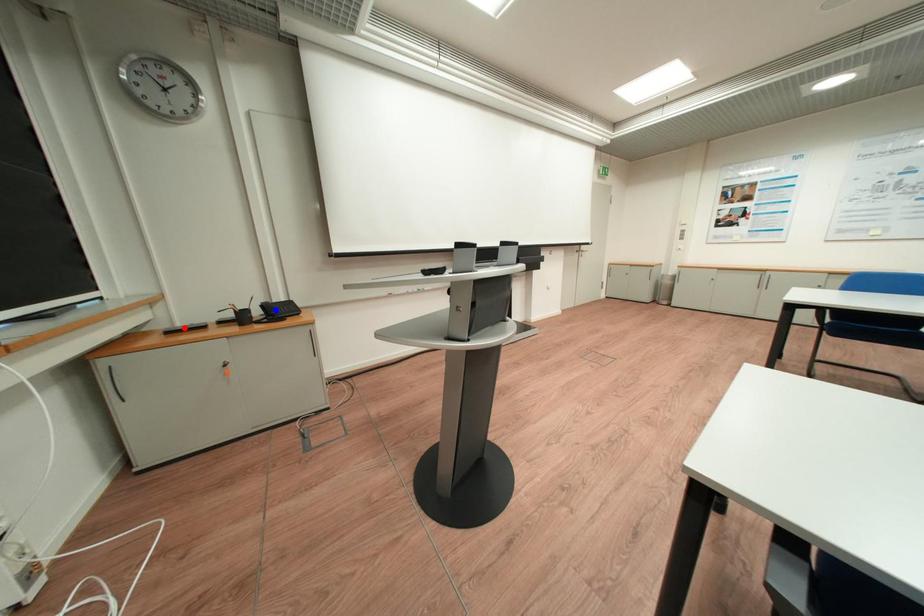
Question: Two points are marked on the image. Which point is closer to the camera?

Choices:
 (A) Blue point is closer.
 (B) Red point is closer.

Answer: (B)